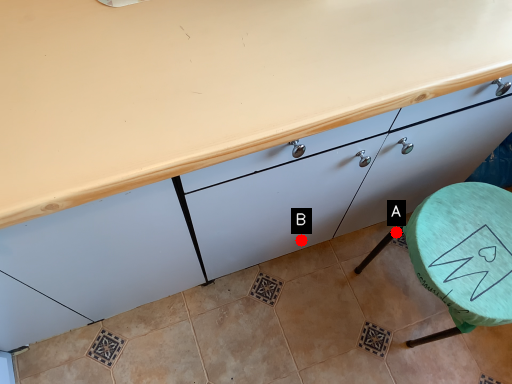
Question: Two points are circled on the image, labeled by A and B beside each circle. Which point is farther from the camera taking this photo?

Choices:
 (A) A is further
 (B) B is further

Answer: (A)